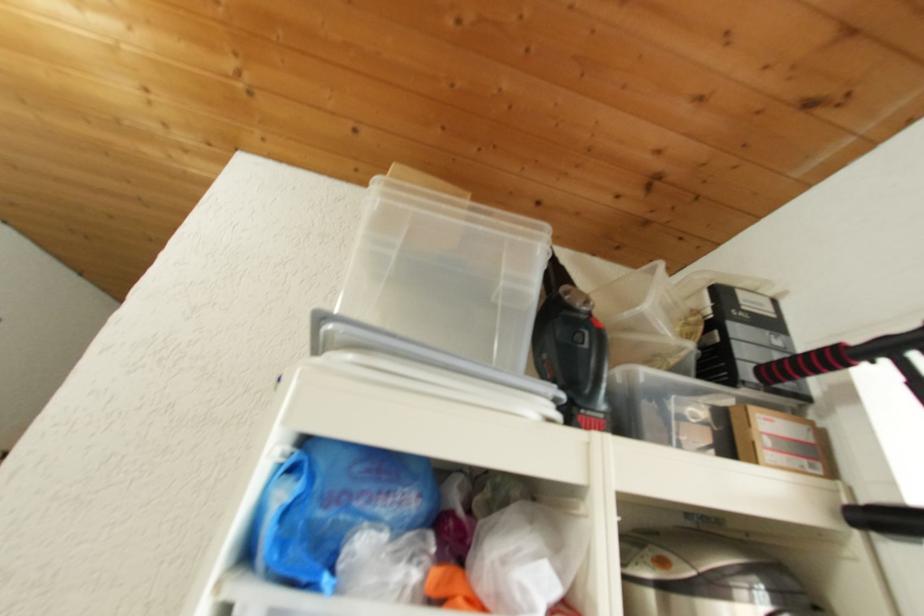
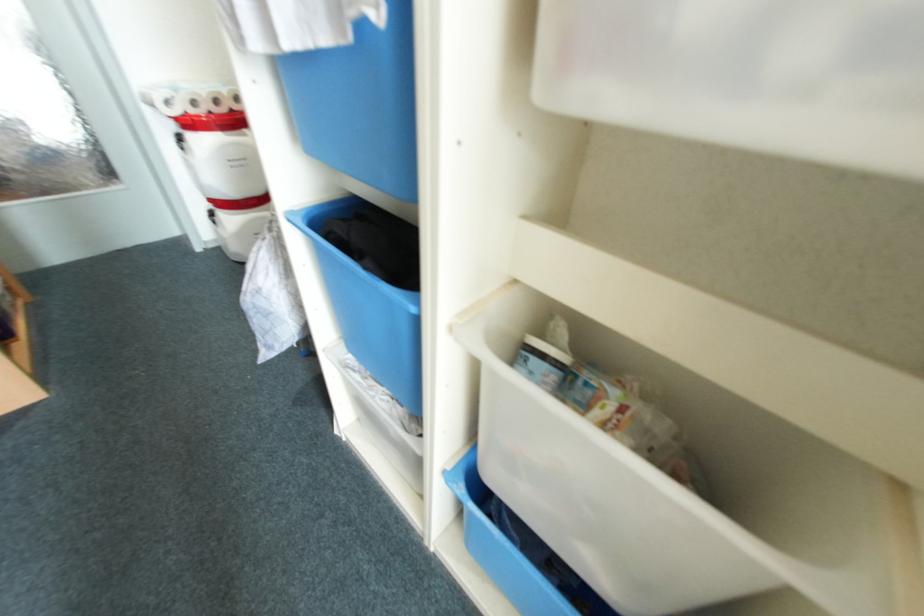
The images are taken continuously from a first-person perspective. In which direction is your viewpoint rotating?

The camera's rotation is toward left-down.